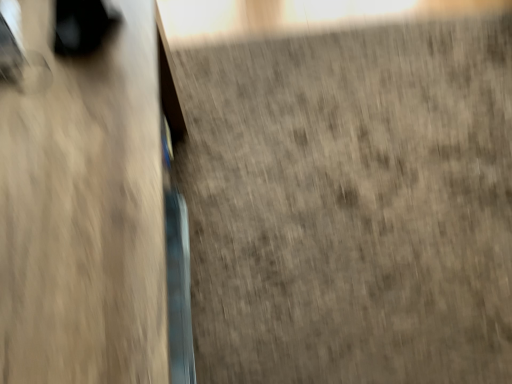
Describe the element at coordinates (90, 197) in the screenshot. Image resolution: width=512 pixels, height=384 pixels. I see `wooden table at left` at that location.

Identify the location of wooden table at left. This screenshot has width=512, height=384. (90, 197).

What is the approximate width of wooden table at left?

It is 21.53 inches.

Locate an element on the screen. Image resolution: width=512 pixels, height=384 pixels. wooden table at left is located at coordinates (90, 197).